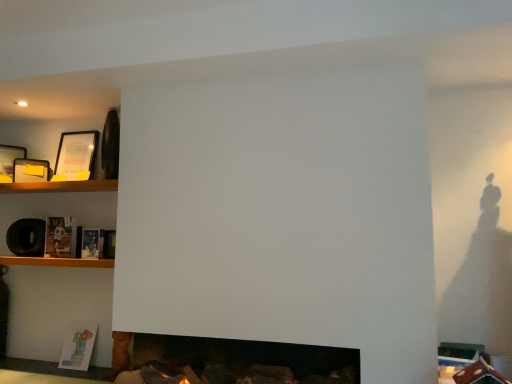
Question: Is matte paper book at lower left, which ranks as the third book in top-to-bottom order, to the right of matte black picture frame at upper left, positioned as the 3th picture frame in right-to-left order, from the viewer's perspective?

Choices:
 (A) yes
 (B) no

Answer: (A)

Question: Is matte paper book at lower left, which ranks as the third book in top-to-bottom order, behind matte black picture frame at upper left, positioned as the 3th picture frame in right-to-left order?

Choices:
 (A) yes
 (B) no

Answer: (B)

Question: From the image's perspective, is matte paper book at lower left, which ranks as the third book in top-to-bottom order, beneath matte black picture frame at upper left, positioned as the 3th picture frame in right-to-left order?

Choices:
 (A) no
 (B) yes

Answer: (B)

Question: Is matte paper book at lower left, which ranks as the third book in top-to-bottom order, bigger than matte black picture frame at upper left, positioned as the 3th picture frame in right-to-left order?

Choices:
 (A) yes
 (B) no

Answer: (A)

Question: From the image's perspective, is matte paper book at lower left, which ranks as the third book in top-to-bottom order, located above matte black picture frame at upper left, positioned as the 3th picture frame in right-to-left order?

Choices:
 (A) no
 (B) yes

Answer: (A)

Question: Is matte paper book at lower left, which is counted as the first book, starting from the bottom, outside of matte black picture frame at upper left, arranged as the 1th picture frame when viewed from the left?

Choices:
 (A) no
 (B) yes

Answer: (B)

Question: Is the surface of matte paper book at lower left, which ranks as the third book in top-to-bottom order, in direct contact with matte black picture frame at left, which is counted as the second picture frame, starting from the left?

Choices:
 (A) no
 (B) yes

Answer: (A)

Question: Is matte paper book at lower left, which is counted as the first book, starting from the bottom, positioned beyond the bounds of matte black picture frame at left, the 2th picture frame from the right?

Choices:
 (A) no
 (B) yes

Answer: (B)

Question: From the image's perspective, is matte paper book at lower left, which ranks as the third book in top-to-bottom order, over matte black picture frame at left, the 2th picture frame from the right?

Choices:
 (A) no
 (B) yes

Answer: (A)

Question: Is matte paper book at lower left, which ranks as the third book in top-to-bottom order, not close to matte black picture frame at left, the 2th picture frame from the right?

Choices:
 (A) yes
 (B) no

Answer: (A)

Question: From a real-world perspective, is matte paper book at lower left, which ranks as the third book in top-to-bottom order, physically below matte black picture frame at left, the 2th picture frame from the right?

Choices:
 (A) no
 (B) yes

Answer: (B)

Question: Is matte paper book at lower left, which is counted as the first book, starting from the bottom, oriented away from matte black picture frame at left, which is counted as the second picture frame, starting from the left?

Choices:
 (A) yes
 (B) no

Answer: (B)

Question: Is matte black picture frame at upper left, marked as the first picture frame in a right-to-left arrangement, at the right side of hardcover book at center-left, which appears as the 2th book when viewed from the top?

Choices:
 (A) no
 (B) yes

Answer: (A)